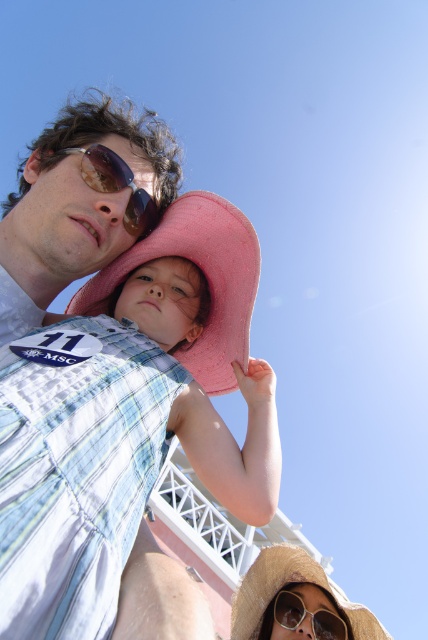
Question: Considering the real-world distances, which object is closest to the white plastic sunglasses at lower center?

Choices:
 (A) pink straw hat at center
 (B) straw hat at upper center

Answer: (B)

Question: Is matte blue denim vest at upper left in front of pink straw hat at center?

Choices:
 (A) no
 (B) yes

Answer: (B)

Question: Which object is the farthest from the matte blue denim vest at upper left?

Choices:
 (A) pink straw hat at center
 (B) shiny brown goggles at center
 (C) white plastic sunglasses at lower center

Answer: (C)

Question: Does pink fabric hat at upper center have a lesser width compared to shiny brown goggles at center?

Choices:
 (A) no
 (B) yes

Answer: (A)

Question: Does matte blue denim vest at upper left have a lesser width compared to straw hat at upper center?

Choices:
 (A) yes
 (B) no

Answer: (B)

Question: Which of the following is the farthest from the observer?

Choices:
 (A) pink straw hat at center
 (B) matte blue denim vest at upper left
 (C) white plastic sunglasses at lower center

Answer: (C)